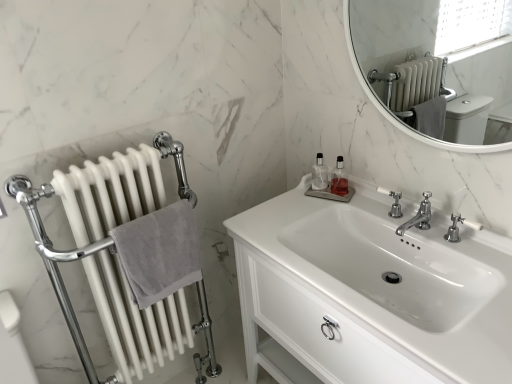
Question: Is white glossy sink at center thinner than polished chrome faucet at center, the 2th tap when ordered from right to left?

Choices:
 (A) yes
 (B) no

Answer: (B)

Question: Is white glossy sink at center located outside polished chrome faucet at center, the 2th tap when ordered from right to left?

Choices:
 (A) yes
 (B) no

Answer: (A)

Question: From a real-world perspective, is white glossy sink at center on polished chrome faucet at center, which ranks as the 1th tap in left-to-right order?

Choices:
 (A) yes
 (B) no

Answer: (B)

Question: Is white glossy sink at center smaller than polished chrome faucet at center, the 2th tap when ordered from right to left?

Choices:
 (A) yes
 (B) no

Answer: (B)

Question: Is white glossy sink at center turned away from polished chrome faucet at center, which ranks as the 1th tap in left-to-right order?

Choices:
 (A) yes
 (B) no

Answer: (B)

Question: Based on their sizes in the image, would you say polished chrome faucet at upper right is bigger or smaller than clear glass bottle at upper center, the first toiletry when ordered from right to left?

Choices:
 (A) small
 (B) big

Answer: (B)

Question: In terms of height, does polished chrome faucet at upper right look taller or shorter compared to clear glass bottle at upper center, the first toiletry when ordered from right to left?

Choices:
 (A) tall
 (B) short

Answer: (B)

Question: In the image, is polished chrome faucet at upper right positioned in front of or behind clear glass bottle at upper center, which is counted as the second toiletry, starting from the left?

Choices:
 (A) behind
 (B) front

Answer: (B)

Question: Is polished chrome faucet at upper right inside or outside of clear glass bottle at upper center, the first toiletry when ordered from right to left?

Choices:
 (A) outside
 (B) inside

Answer: (A)

Question: Relative to white marble mirror at upper right, is clear glass bottle at upper center, which is counted as the second toiletry, starting from the left, in front or behind?

Choices:
 (A) behind
 (B) front

Answer: (A)

Question: From a real-world perspective, relative to white marble mirror at upper right, is clear glass bottle at upper center, the first toiletry when ordered from right to left, vertically above or below?

Choices:
 (A) below
 (B) above

Answer: (A)

Question: Is clear glass bottle at upper center, which is counted as the second toiletry, starting from the left, wider or thinner than white marble mirror at upper right?

Choices:
 (A) thin
 (B) wide

Answer: (B)

Question: In terms of size, does clear glass bottle at upper center, the first toiletry when ordered from right to left, appear bigger or smaller than white marble mirror at upper right?

Choices:
 (A) small
 (B) big

Answer: (A)

Question: Looking at the image, does clear glass bottle at upper center, arranged as the 2th toiletry when viewed from the right, seem bigger or smaller compared to polished chrome faucet at upper right?

Choices:
 (A) small
 (B) big

Answer: (B)

Question: In terms of width, does clear glass bottle at upper center, marked as the first toiletry in a left-to-right arrangement, look wider or thinner when compared to polished chrome faucet at upper right?

Choices:
 (A) thin
 (B) wide

Answer: (A)